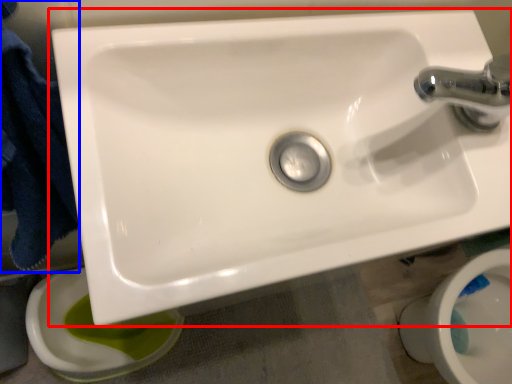
Question: Which point is closer to the camera, sink (highlighted by a red box) or bath towel (highlighted by a blue box)?

Choices:
 (A) sink
 (B) bath towel

Answer: (B)